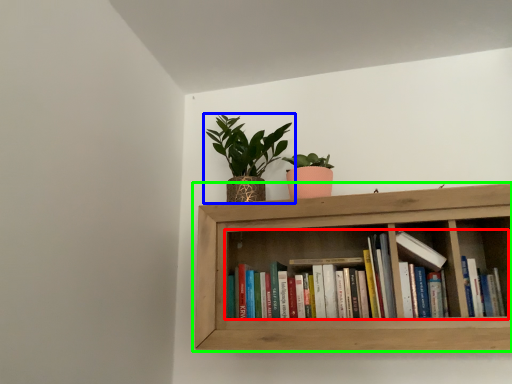
Question: Based on their relative distances, which object is nearer to book (highlighted by a red box)? Choose from houseplant (highlighted by a blue box) and shelf (highlighted by a green box).

Choices:
 (A) houseplant
 (B) shelf

Answer: (B)